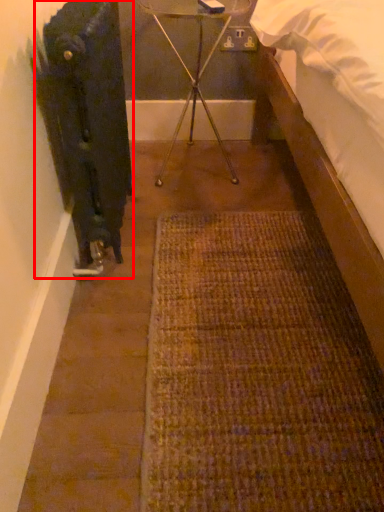
Question: Observing the image, what is the correct spatial positioning of radiator (annotated by the red box) in reference to tripod?

Choices:
 (A) left
 (B) right

Answer: (A)